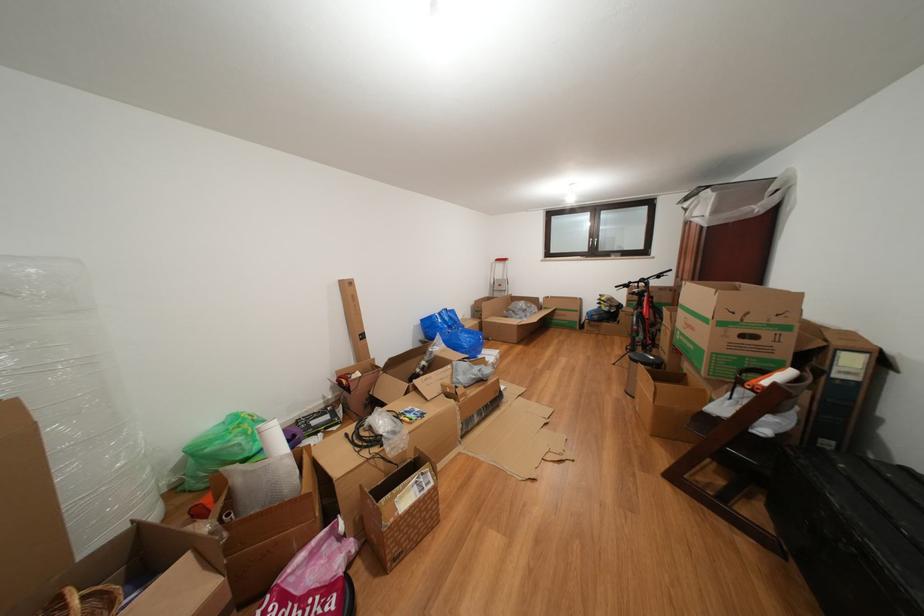
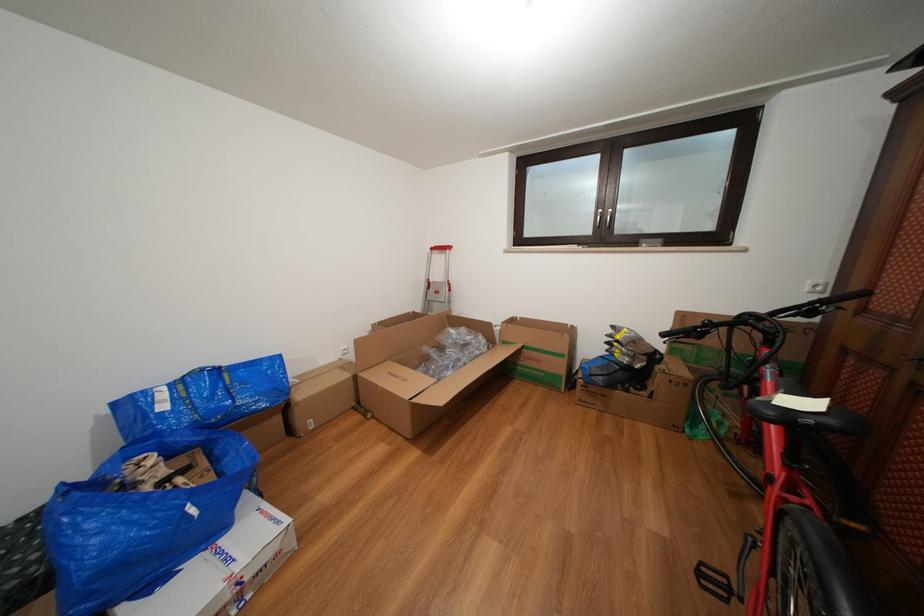
In the second image, find the point that corresponds to point (585, 315) in the first image.

(570, 361)